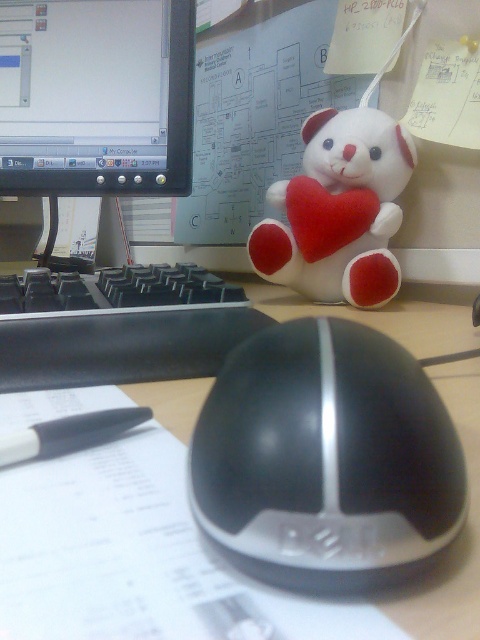
You are organizing your desk and want to place the white plush bear at upper center closer to the computer mouse. How much distance do you need to move it to align with the mouse?

The white plush bear at upper center is 26.39 inches away from the computer mouse. To align them, move the bear 26.39 inches towards the mouse.

You need to place a new keyboard between the matte plastic monitor at upper left and the black plastic pen at center. Based on their positions, which object should the keyboard be closer to?

The keyboard should be placed closer to the matte plastic monitor at upper left because it is positioned to the left of the black plastic pen at center.

You are organizing your desk and need to know which object is wider between the matte plastic monitor at upper left and the black plastic pen at center. Can you determine this?

The matte plastic monitor at upper left is wider than the black plastic pen at center according to the description.